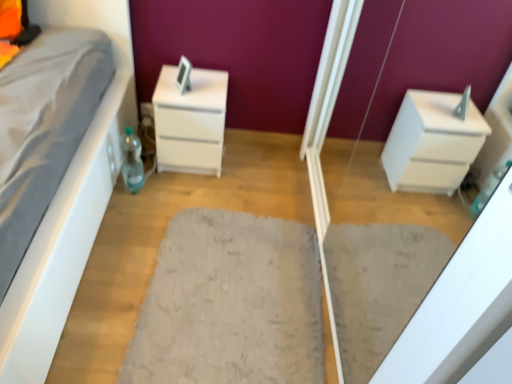
Find the location of a particular element. The width and height of the screenshot is (512, 384). free space between translucent plastic bottle at lower left and gray fluffy rug at center is located at coordinates (160, 233).